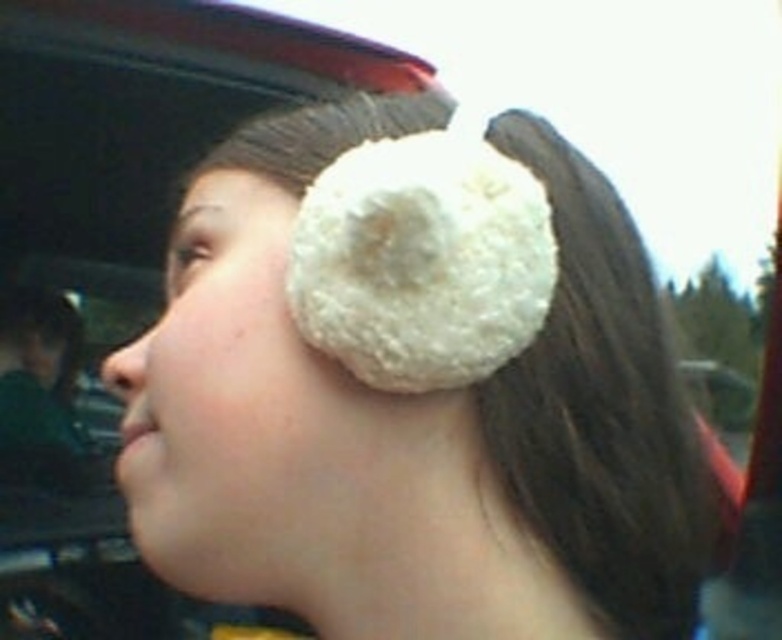
Measure the distance between point (224, 342) and camera.

A distance of 48.08 centimeters exists between point (224, 342) and camera.

Which of these two, white fluffy earmuffs at upper right or white fluffy ear muffs at upper right, stands taller?

white fluffy earmuffs at upper right is taller.

Which is in front, point (540, 396) or point (185, 474)?

Point (185, 474)

I want to click on white fluffy earmuffs at upper right, so click(x=413, y=387).